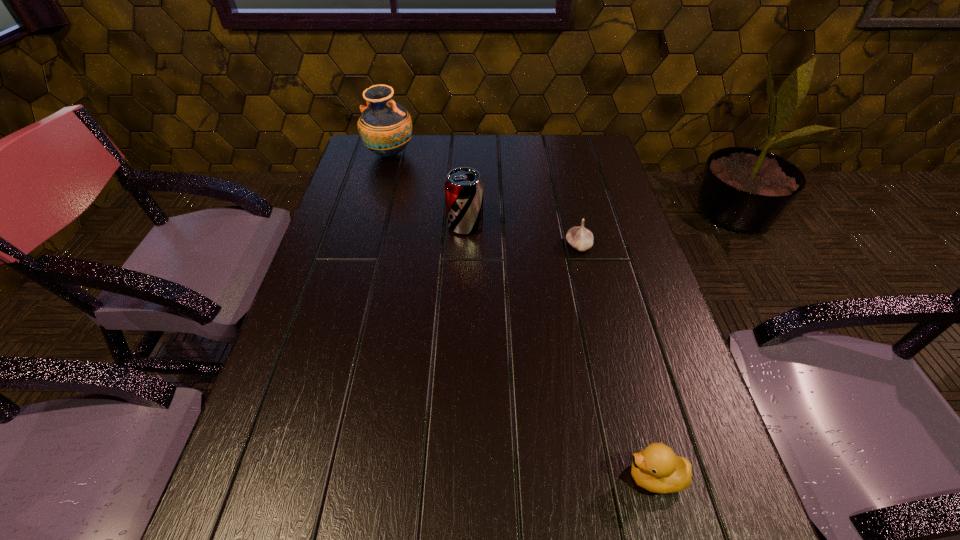
The width and height of the screenshot is (960, 540). Find the location of `free spot located 0.330m facing forward on the nearest object`. free spot located 0.330m facing forward on the nearest object is located at coordinates (425, 477).

Identify the location of free region located on the left of the garlic. (418, 246).

Image resolution: width=960 pixels, height=540 pixels. In order to click on object at the far edge in this screenshot , I will do click(x=385, y=126).

Locate an element on the screen. The width and height of the screenshot is (960, 540). object that is positioned at the left edge is located at coordinates (385, 126).

The width and height of the screenshot is (960, 540). Identify the location of duckling present at the right edge. (657, 468).

The width and height of the screenshot is (960, 540). I want to click on garlic at the right edge, so click(x=580, y=238).

The height and width of the screenshot is (540, 960). In order to click on object at the far left corner in this screenshot , I will do `click(385, 126)`.

This screenshot has width=960, height=540. In order to click on free space at the far edge of the desktop in this screenshot , I will do `click(543, 167)`.

Find the location of `vacant space at the left edge`. vacant space at the left edge is located at coordinates (372, 258).

In order to click on free region at the right edge of the desktop in this screenshot , I will do `click(664, 506)`.